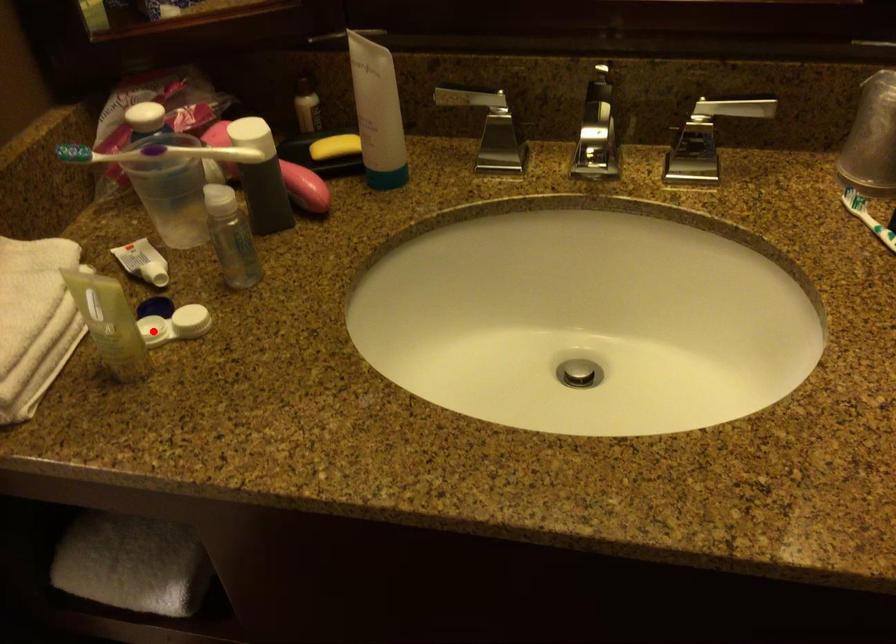
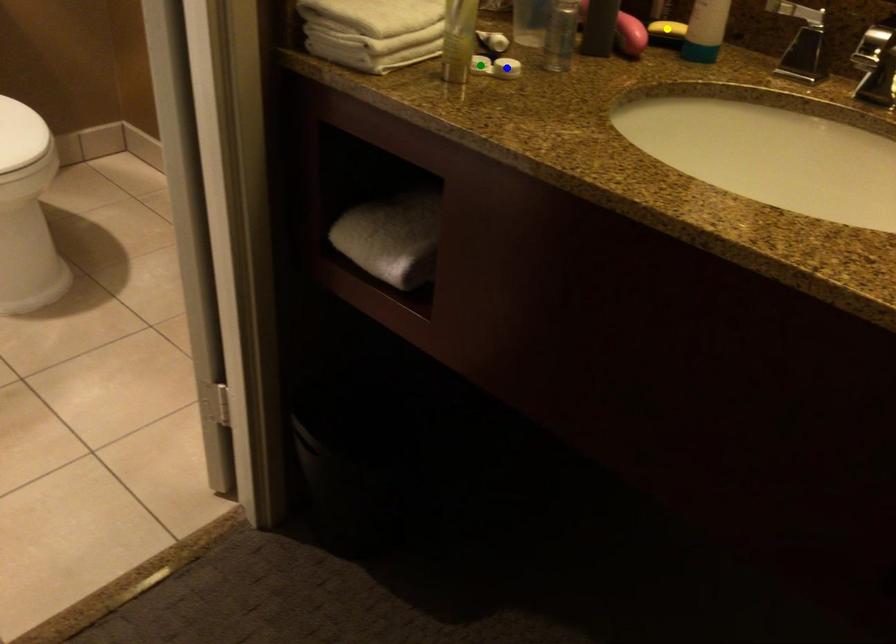
Question: I am providing you with two images of the same scene from different viewpoints. A red point is marked on the first image. You are given multiple points on the second image. Which spot in image 2 lines up with the point in image 1?

Choices:
 (A) green point
 (B) yellow point
 (C) blue point

Answer: (A)